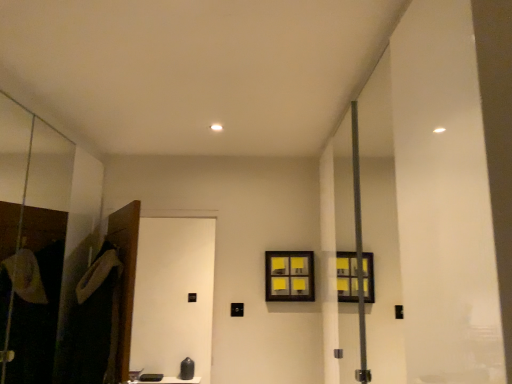
Question: Is black matte screen door at lower left, which appears as the 1th screen door when viewed from the right, spatially inside yellow sticky notes at center, or outside of it?

Choices:
 (A) outside
 (B) inside

Answer: (A)

Question: In terms of width, does black matte screen door at lower left, which appears as the 1th screen door when viewed from the right, look wider or thinner when compared to yellow sticky notes at center?

Choices:
 (A) wide
 (B) thin

Answer: (A)

Question: Which object is positioned farthest from the black matte screen door at lower left, which is the 2th screen door in left-to-right order?

Choices:
 (A) transparent glass screen door at left, marked as the 2th screen door in a right-to-left arrangement
 (B) dark gray fabric robe at left
 (C) yellow sticky notes at center

Answer: (B)

Question: Which is farther from the transparent glass screen door at left, the 1th screen door viewed from the left?

Choices:
 (A) dark gray fabric robe at left
 (B) black matte screen door at lower left, which is the 2th screen door in left-to-right order
 (C) yellow sticky notes at center

Answer: (B)